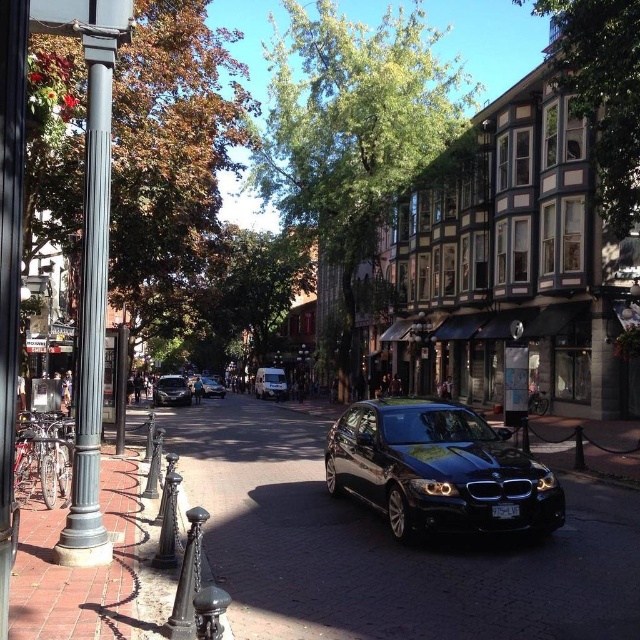
You are standing on the sidewalk paved with red to the left of the street. You want to cross the street to reach the glossy black car at center. Is the car positioned in a place where you can safely approach it from the sidewalk?

The glossy black car at center is located at point (438, 470), which means it is positioned in the foreground on the right side of the street. Since you are on the left sidewalk, you would need to cross the street to reach it. However, the car is parked in the right lane, so after crossing, you can safely approach it from the sidewalk on the right side where the car is located.

You are a pedestrian standing on the sidewalk on the left side of the street. You want to cross to the shops on the right. To do so, you need to walk past the shiny silver sedan at center. However, there is a polished metal streetlamp at center in your path. Which object will you encounter first as you walk towards the shops?

You will encounter the shiny silver sedan at center first because the polished metal streetlamp at center is to the right of it, meaning the sedan is closer to your starting position on the left sidewalk.